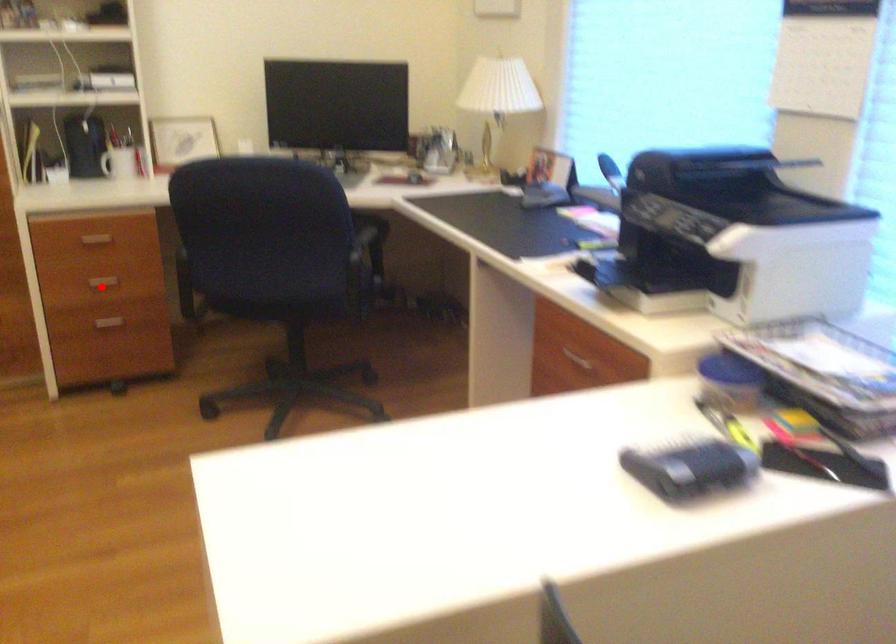
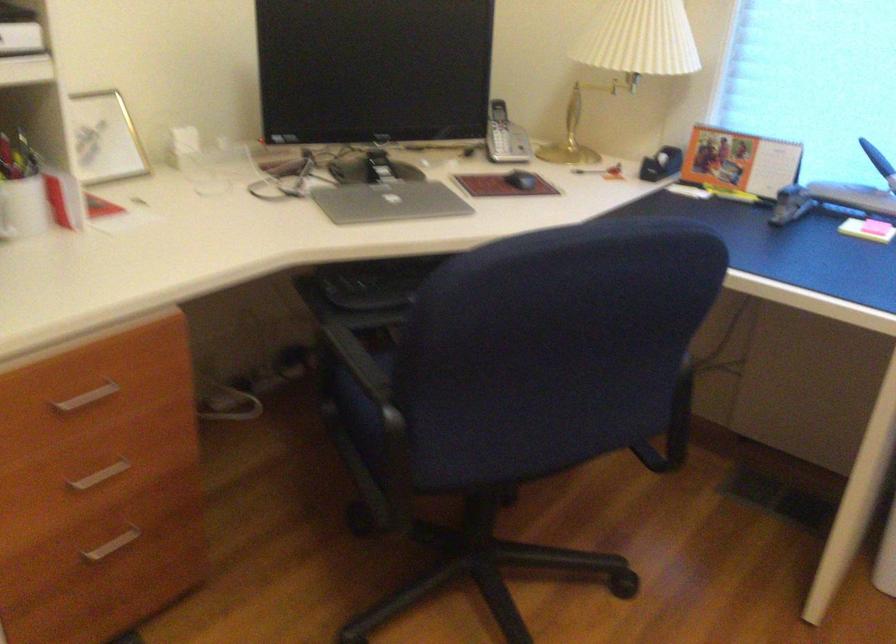
Question: I am providing you with two images of the same scene from different viewpoints. Image1 has a red point marked. In image2, the corresponding 3D location appears at what relative position? Reply with the corresponding letter.

Choices:
 (A) Closer
 (B) Farther

Answer: (A)